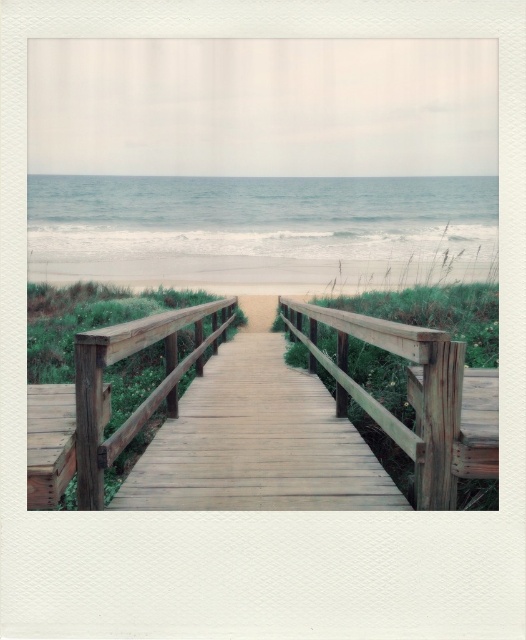
Consider the image. You are a maintenance worker inspecting the boardwalk. You notice the wooden bridge at center and the wooden rail at center. Which object is located below the other?

The wooden bridge at center is positioned under the wooden rail at center, so the wooden bridge at center is below the wooden rail at center.

You are standing on the wooden boardwalk and want to walk to the beige sandy beach at center. Which direction should you go relative to the wooden bridge at center?

You should walk to the left of the wooden bridge at center to reach the beige sandy beach at center since the wooden bridge at center is to the right of the beige sandy beach at center.

You are a tourist standing on the wooden boardwalk and want to walk to the beige sandy beach at center. Which direction should you move relative to the wooden rail at center?

You should move away from the wooden rail at center towards the beige sandy beach at center since the wooden rail at center is in front of the beige sandy beach at center, meaning the beach is behind the rail from your perspective.